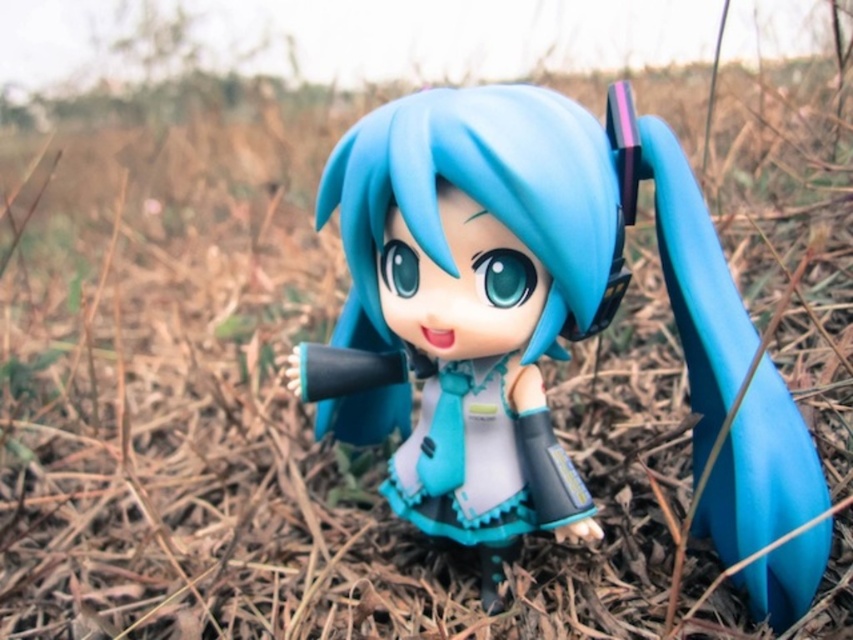
Question: Is matte plastic toy at center positioned at the back of semi-glossy blue hair at center?

Choices:
 (A) yes
 (B) no

Answer: (A)

Question: Does matte plastic toy at center have a lesser width compared to semi-glossy blue hair at center?

Choices:
 (A) yes
 (B) no

Answer: (B)

Question: Among these objects, which one is nearest to the camera?

Choices:
 (A) matte plastic toy at center
 (B) semi-glossy blue hair at center

Answer: (B)

Question: In this image, where is matte plastic toy at center located relative to semi-glossy blue hair at center?

Choices:
 (A) below
 (B) above

Answer: (A)

Question: Among these objects, which one is farthest from the camera?

Choices:
 (A) matte plastic toy at center
 (B) semi-glossy blue hair at center

Answer: (A)